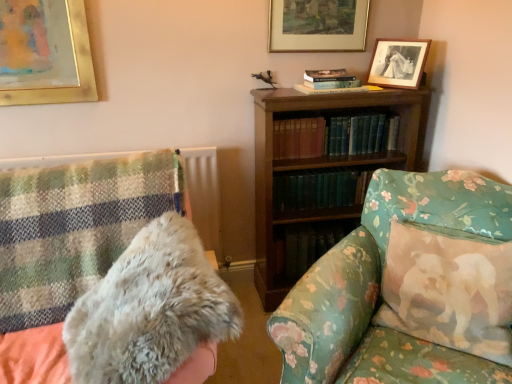
Question: Is fluffy cotton pillow at right further to camera compared to green hardcover books at center, positioned as the 2th book in top-to-bottom order?

Choices:
 (A) no
 (B) yes

Answer: (A)

Question: Can you confirm if fluffy cotton pillow at right is shorter than green hardcover books at center, positioned as the 2th book in top-to-bottom order?

Choices:
 (A) no
 (B) yes

Answer: (A)

Question: Does fluffy cotton pillow at right have a greater width compared to green hardcover books at center, placed as the first book when sorted from bottom to top?

Choices:
 (A) no
 (B) yes

Answer: (B)

Question: Is fluffy cotton pillow at right surrounding green hardcover books at center, positioned as the 2th book in top-to-bottom order?

Choices:
 (A) no
 (B) yes

Answer: (A)

Question: From the image's perspective, is fluffy cotton pillow at right on top of green hardcover books at center, placed as the first book when sorted from bottom to top?

Choices:
 (A) yes
 (B) no

Answer: (B)

Question: Are fluffy cotton pillow at right and green hardcover books at center, positioned as the 2th book in top-to-bottom order, beside each other?

Choices:
 (A) no
 (B) yes

Answer: (A)

Question: From a real-world perspective, is green leather book at center, which ranks as the 2th book in bottom-to-top order, physically above floral fabric couch at center?

Choices:
 (A) yes
 (B) no

Answer: (A)

Question: From the image's perspective, does green leather book at center, which ranks as the 2th book in bottom-to-top order, appear lower than floral fabric couch at center?

Choices:
 (A) no
 (B) yes

Answer: (A)

Question: Is green leather book at center, which ranks as the 2th book in bottom-to-top order, bigger than floral fabric couch at center?

Choices:
 (A) no
 (B) yes

Answer: (A)

Question: From a real-world perspective, is green leather book at center, which ranks as the 2th book in bottom-to-top order, physically below floral fabric couch at center?

Choices:
 (A) no
 (B) yes

Answer: (A)

Question: Could you tell me if green leather book at center, which ranks as the 2th book in bottom-to-top order, is facing floral fabric couch at center?

Choices:
 (A) no
 (B) yes

Answer: (A)

Question: Is green leather book at center, which ranks as the 2th book in bottom-to-top order, oriented away from floral fabric couch at center?

Choices:
 (A) no
 (B) yes

Answer: (A)

Question: Are green hardcover books at center, placed as the first book when sorted from bottom to top, and floral fabric couch at center beside each other?

Choices:
 (A) no
 (B) yes

Answer: (A)